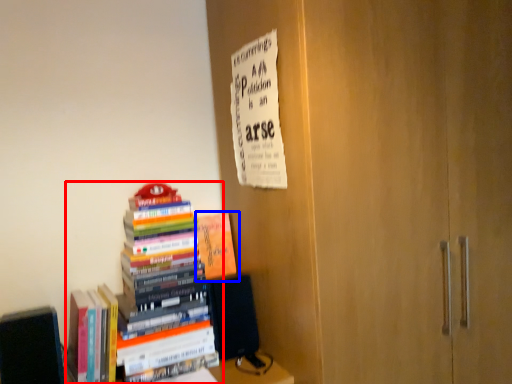
Question: Which object appears farthest to the camera in this image, book (highlighted by a red box) or book (highlighted by a blue box)?

Choices:
 (A) book
 (B) book

Answer: (B)